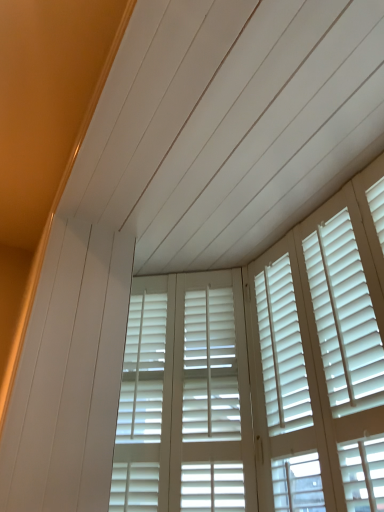
Question: Considering the relative positions of white matte shutters at center and white wood blinds at center in the image provided, is white matte shutters at center to the left or to the right of white wood blinds at center?

Choices:
 (A) left
 (B) right

Answer: (B)

Question: From the image's perspective, is white matte shutters at center positioned above or below white wood blinds at center?

Choices:
 (A) above
 (B) below

Answer: (B)

Question: Is white matte shutters at center in front of or behind white wood blinds at center in the image?

Choices:
 (A) behind
 (B) front

Answer: (A)

Question: Is white wood blinds at center bigger or smaller than white matte shutters at center?

Choices:
 (A) big
 (B) small

Answer: (A)

Question: Is white wood blinds at center wider or thinner than white matte shutters at center?

Choices:
 (A) thin
 (B) wide

Answer: (A)

Question: Is point (185, 296) closer or farther from the camera than point (208, 350)?

Choices:
 (A) farther
 (B) closer

Answer: (A)

Question: From the image's perspective, is white wood blinds at center located above or below white matte shutters at center?

Choices:
 (A) below
 (B) above

Answer: (B)